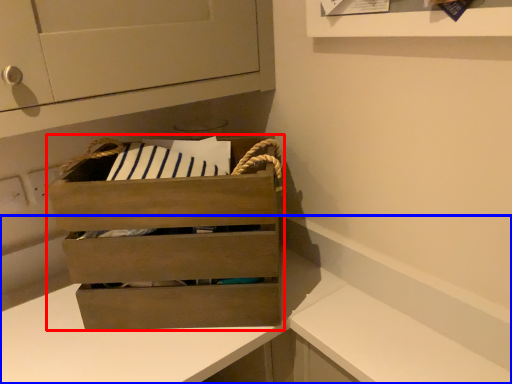
Question: Which point is closer to the camera, chest of drawers (highlighted by a red box) or counter (highlighted by a blue box)?

Choices:
 (A) chest of drawers
 (B) counter

Answer: (B)